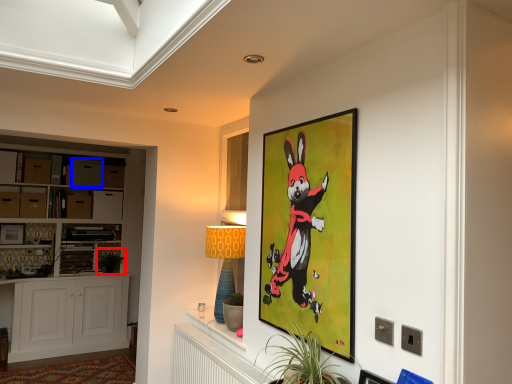
Question: Among these objects, which one is farthest to the camera, plant (highlighted by a red box) or drawer (highlighted by a blue box)?

Choices:
 (A) plant
 (B) drawer

Answer: (A)